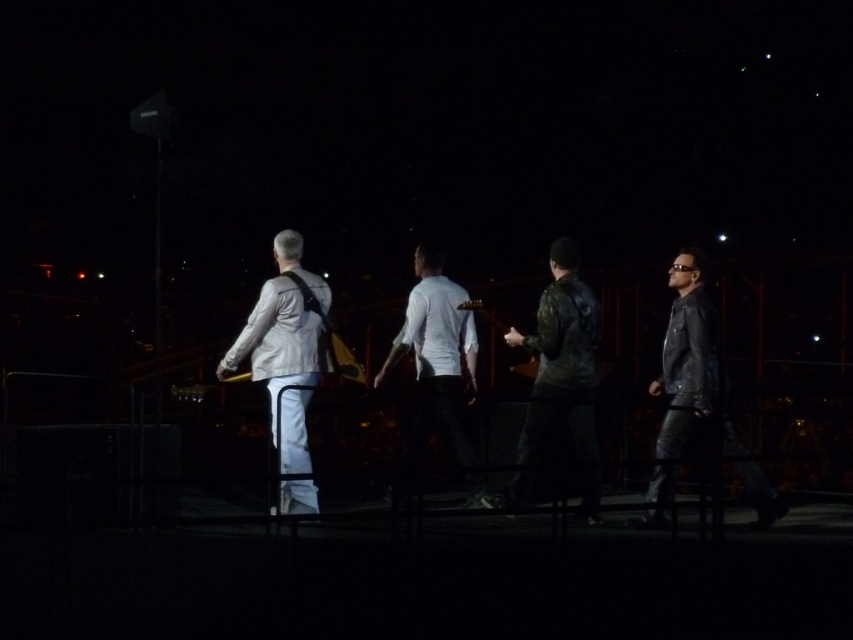
You are a photographer trying to capture a clear shot of both the leather jacket at right and the white matte shirt at center. Since the stage is dimly lit, you want to ensure both are well illuminated. Which object should you adjust your camera focus on first to ensure proper lighting?

The leather jacket at right is positioned under the white matte shirt at center. Therefore, you should focus on the white matte shirt at center first because it is higher and might be in a brighter area closer to the stage lights, ensuring better illumination.

Consider the image. You are a photographer adjusting lighting for a stage performance. You need to ensure that both the leather jacket at right and the white matte shirt at center are evenly lit. Given their sizes, which one might require more light to achieve the same brightness?

The leather jacket at right is wider than the white matte shirt at center. To achieve the same brightness, the leather jacket at right would need more light since it has a larger surface area.

You are a photographer standing at the back of the stage. You want to take a photo of the two leather jackets on the stage. Which one will be more visible in your photo? The leather jacket at center or the leather jacket at right?

The leather jacket at center is much taller than the leather jacket at right, so it will be more visible in the photo.